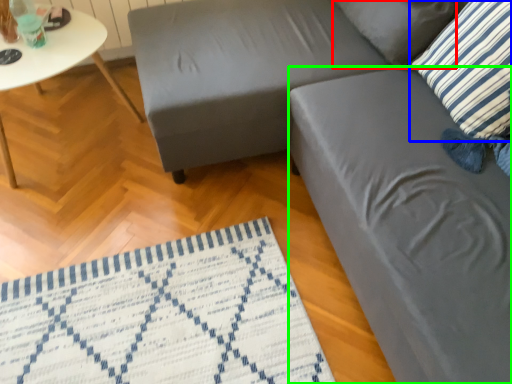
Question: Considering the real-world distances, which object is closest to pillow (highlighted by a red box)? pillow (highlighted by a blue box) or swivel chair (highlighted by a green box).

Choices:
 (A) pillow
 (B) swivel chair

Answer: (A)